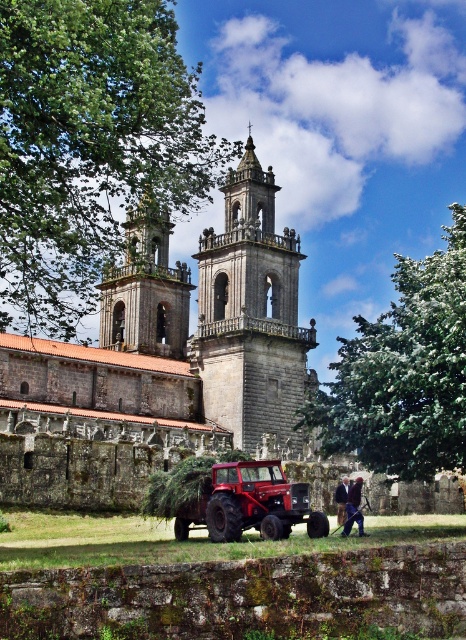
Is metallic red tractor at center to the left of dark brown leather jacket at lower center from the viewer's perspective?

Correct, you'll find metallic red tractor at center to the left of dark brown leather jacket at lower center.

Which is in front, point (218, 490) or point (340, 493)?

Point (218, 490) is in front.

Where is `metallic red tractor at center`? This screenshot has height=640, width=466. metallic red tractor at center is located at coordinates (249, 502).

Can you confirm if gray stone bell tower at center is thinner than dark brown leather jacket at lower center?

No, gray stone bell tower at center is not thinner than dark brown leather jacket at lower center.

Which is below, gray stone bell tower at center or dark brown leather jacket at lower center?

dark brown leather jacket at lower center is lower down.

Is point (290, 230) more distant than point (338, 497)?

Yes.

Identify the location of gray stone bell tower at center. [251, 316].

Does stone church at center come in front of dark brown leather jacket at lower center?

No, stone church at center is further to the viewer.

Is stone church at center thinner than dark brown leather jacket at lower center?

Incorrect, stone church at center's width is not less than dark brown leather jacket at lower center's.

This screenshot has height=640, width=466. Identify the location of stone church at center. (163, 362).